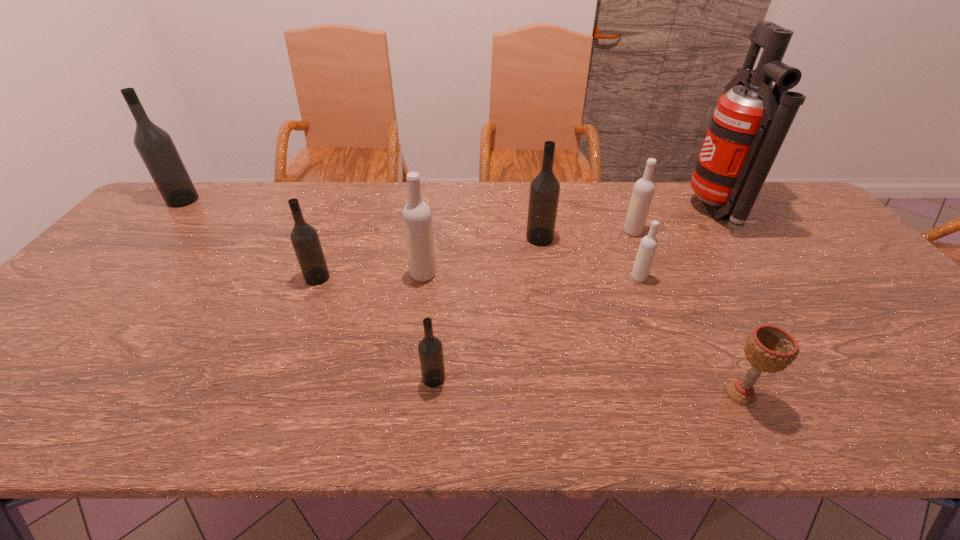
I want to click on vacant space located on the left of the leftmost white vodka, so click(373, 274).

Locate an element on the screen. The height and width of the screenshot is (540, 960). blank space located on the right of the farthest white vodka is located at coordinates (695, 232).

The image size is (960, 540). Find the location of `free space located on the left of the eighth object from right to left`. free space located on the left of the eighth object from right to left is located at coordinates (242, 278).

The height and width of the screenshot is (540, 960). In order to click on vacant position located on the back of the nearest vodka in this screenshot , I will do `click(437, 340)`.

Locate an element on the screen. The height and width of the screenshot is (540, 960). vacant space located 0.320m on the front of the smallest white vodka is located at coordinates (682, 387).

What are the coordinates of `free spot located on the left of the chalice` in the screenshot? It's located at (662, 394).

I want to click on fire extinguisher that is at the far edge, so click(x=750, y=122).

Locate an element on the screen. vodka located at the far edge is located at coordinates (155, 146).

The height and width of the screenshot is (540, 960). I want to click on object that is at the near edge, so click(768, 348).

At what (x,y) coordinates should I click in order to perform the action: click on object that is at the left edge. Please return your answer as a coordinate pair (x, y). Looking at the image, I should click on (155, 146).